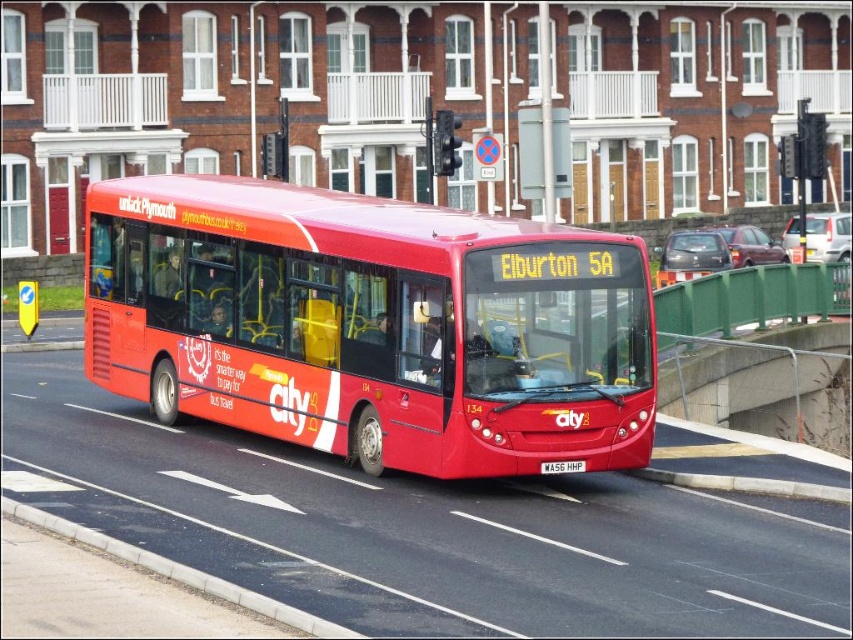
Question: Is shiny red bus at center further to camera compared to black asphalt curb at lower left?

Choices:
 (A) yes
 (B) no

Answer: (A)

Question: Which point is farther to the camera?

Choices:
 (A) white matte license plate at center
 (B) shiny red bus at center
 (C) black asphalt curb at lower left

Answer: (A)

Question: Where is shiny red bus at center located in relation to black asphalt curb at lower left in the image?

Choices:
 (A) above
 (B) below

Answer: (A)

Question: Can you confirm if black asphalt curb at lower left is wider than white matte license plate at center?

Choices:
 (A) yes
 (B) no

Answer: (A)

Question: Which object is positioned farthest from the shiny red bus at center?

Choices:
 (A) white matte license plate at center
 (B) black asphalt curb at lower left

Answer: (B)

Question: Which object is closer to the camera taking this photo?

Choices:
 (A) shiny red bus at center
 (B) black asphalt curb at lower left

Answer: (B)